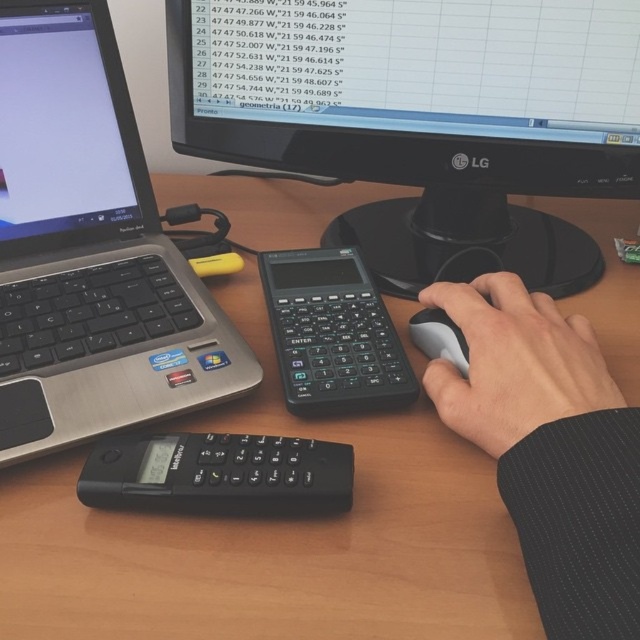
Can you confirm if wooden table at center is smaller than skinny black sleeve at lower center?

Incorrect, wooden table at center is not smaller in size than skinny black sleeve at lower center.

Which of these two, wooden table at center or skinny black sleeve at lower center, stands taller?

wooden table at center

Does point (236, 228) come closer to viewer compared to point (492, 301)?

That is False.

The image size is (640, 640). Find the location of `wooden table at center`. wooden table at center is located at coordinates (273, 538).

Can you confirm if black plastic monitor at upper center is taller than black plastic calculator at center?

Correct, black plastic monitor at upper center is much taller as black plastic calculator at center.

Between black plastic monitor at upper center and black plastic calculator at center, which one appears on the left side from the viewer's perspective?

black plastic calculator at center

The height and width of the screenshot is (640, 640). What do you see at coordinates (422, 120) in the screenshot? I see `black plastic monitor at upper center` at bounding box center [422, 120].

At what (x,y) coordinates should I click in order to perform the action: click on black plastic monitor at upper center. Please return your answer as a coordinate pair (x, y). Looking at the image, I should click on (422, 120).

Who is higher up, black plastic monitor at upper center or black rubber mouse at center?

black plastic monitor at upper center is above.

Is point (218, 68) positioned after point (436, 333)?

Yes.

Locate an element on the screen. black plastic monitor at upper center is located at coordinates (422, 120).

This screenshot has width=640, height=640. Identify the location of black plastic monitor at upper center. (422, 120).